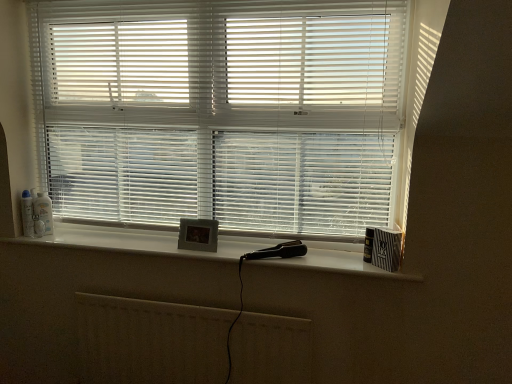
This screenshot has width=512, height=384. What do you see at coordinates (44, 211) in the screenshot? I see `white plastic bottle at left, the 1th toiletry viewed from the right` at bounding box center [44, 211].

Find the location of `white plastic bottle at left, the 1th toiletry viewed from the right`. white plastic bottle at left, the 1th toiletry viewed from the right is located at coordinates coord(44,211).

This screenshot has width=512, height=384. I want to click on white glossy spray can at left, which is the second toiletry in right-to-left order, so click(27, 214).

Is white glossy spray can at left, which is the second toiletry in right-to-left order, looking in the opposite direction of white matte window sill at center?

white glossy spray can at left, which is the second toiletry in right-to-left order, does not have its back to white matte window sill at center.

Consider the image. Can you confirm if white glossy spray can at left, which is the second toiletry in right-to-left order, is positioned to the right of white matte window sill at center?

No, white glossy spray can at left, which is the second toiletry in right-to-left order, is not to the right of white matte window sill at center.

Is there a large distance between white glossy spray can at left, which is the second toiletry in right-to-left order, and white matte window sill at center?

Actually, white glossy spray can at left, which is the second toiletry in right-to-left order, and white matte window sill at center are a little close together.

From the white matte window sill at center, count 1st toiletrys backward and point to it. Please provide its 2D coordinates.

[(27, 214)]

Between white matte radiator at lower center and white plastic blinds at center, which one has less height?

white matte radiator at lower center.

From the image's perspective, is white matte radiator at lower center over white plastic blinds at center?

No, from the image's perspective, white matte radiator at lower center is not on top of white plastic blinds at center.

The width and height of the screenshot is (512, 384). I want to click on window blind that appears above the white matte radiator at lower center (from the image's perspective), so click(222, 111).

Are white matte radiator at lower center and white plastic blinds at center beside each other?

No.

Which object is closer to the camera taking this photo, white matte radiator at lower center or white plastic bottle at left, which is the 2th toiletry from left to right?

white matte radiator at lower center is in front.

Is white matte radiator at lower center thinner than white plastic bottle at left, the 1th toiletry viewed from the right?

No.

Considering the positions of point (266, 355) and point (38, 209), is point (266, 355) closer or farther from the camera than point (38, 209)?

Point (266, 355) appears to be closer to the viewer than point (38, 209).

From the image's perspective, which is below, white matte radiator at lower center or white plastic bottle at left, which is the 2th toiletry from left to right?

white matte radiator at lower center is shown below in the image.

Considering the sizes of objects white matte window sill at center and white plastic bottle at left, which is the 2th toiletry from left to right, in the image provided, who is bigger, white matte window sill at center or white plastic bottle at left, which is the 2th toiletry from left to right,?

Bigger between the two is white matte window sill at center.

Does white matte window sill at center turn towards white plastic bottle at left, the 1th toiletry viewed from the right?

No, white matte window sill at center is not facing towards white plastic bottle at left, the 1th toiletry viewed from the right.

Is white matte window sill at center directly adjacent to white plastic bottle at left, the 1th toiletry viewed from the right?

No, white matte window sill at center is not making contact with white plastic bottle at left, the 1th toiletry viewed from the right.

Do you think white plastic bottle at left, which is the 2th toiletry from left to right, is within white glossy spray can at left, acting as the 1th toiletry starting from the left, or outside of it?

white plastic bottle at left, which is the 2th toiletry from left to right, cannot be found inside white glossy spray can at left, acting as the 1th toiletry starting from the left.

From the image's perspective, is white plastic bottle at left, which is the 2th toiletry from left to right, above or below white glossy spray can at left, which is the second toiletry in right-to-left order?

From the image's perspective, white plastic bottle at left, which is the 2th toiletry from left to right, appears above white glossy spray can at left, which is the second toiletry in right-to-left order.

Is point (46, 232) closer or farther from the camera than point (31, 203)?

Point (46, 232) is positioned farther from the camera compared to point (31, 203).

From a real-world perspective, is white plastic bottle at left, which is the 2th toiletry from left to right, physically below white glossy spray can at left, which is the second toiletry in right-to-left order?

Yes, from a real-world perspective, white plastic bottle at left, which is the 2th toiletry from left to right, is beneath white glossy spray can at left, which is the second toiletry in right-to-left order.

Is white matte radiator at lower center bigger or smaller than white matte window sill at center?

white matte radiator at lower center is bigger than white matte window sill at center.

From the image's perspective, is white matte radiator at lower center located above or below white matte window sill at center?

From the image's perspective, white matte radiator at lower center appears below white matte window sill at center.

Considering their positions, is white matte radiator at lower center located in front of or behind white matte window sill at center?

Visually, white matte radiator at lower center is located behind white matte window sill at center.

The width and height of the screenshot is (512, 384). In order to click on window sill located above the white matte radiator at lower center (from a real-world perspective) in this screenshot , I will do `click(142, 241)`.

How many degrees apart are the facing directions of white plastic bottle at left, the 1th toiletry viewed from the right, and white matte radiator at lower center?

They differ by 48.4 degrees in their facing directions.

Based on the photo, which is correct: white plastic bottle at left, the 1th toiletry viewed from the right, is inside white matte radiator at lower center, or outside of it?

The correct answer is: outside.

Considering the relative positions of white plastic bottle at left, the 1th toiletry viewed from the right, and white matte radiator at lower center in the image provided, is white plastic bottle at left, the 1th toiletry viewed from the right, behind white matte radiator at lower center?

Yes, the depth of white plastic bottle at left, the 1th toiletry viewed from the right, is greater than that of white matte radiator at lower center.

From the image's perspective, would you say white plastic bottle at left, which is the 2th toiletry from left to right, is positioned over white matte radiator at lower center?

Yes, from the image's perspective, white plastic bottle at left, which is the 2th toiletry from left to right, is over white matte radiator at lower center.

You are a GUI agent. You are given a task and a screenshot of the screen. Output one action in this format:
    pyautogui.click(x=<x>, y=<y>)
    Task: Click on the window sill on the right of white glossy spray can at left, acting as the 1th toiletry starting from the left
    The width and height of the screenshot is (512, 384).
    Given the screenshot: What is the action you would take?
    pyautogui.click(x=142, y=241)

Where is `window blind above the white matte radiator at lower center (from the image's perspective)`? window blind above the white matte radiator at lower center (from the image's perspective) is located at coordinates pos(222,111).

Looking at the image, which one is located closer to white matte window sill at center, white glossy spray can at left, which is the second toiletry in right-to-left order, or white plastic blinds at center?

white plastic blinds at center.

From the picture: Estimate the real-world distances between objects in this image. Which object is closer to white plastic bottle at left, which is the 2th toiletry from left to right, white matte window sill at center or white glossy spray can at left, acting as the 1th toiletry starting from the left?

white glossy spray can at left, acting as the 1th toiletry starting from the left, lies closer to white plastic bottle at left, which is the 2th toiletry from left to right, than the other object.

Considering their positions, is white plastic blinds at center positioned further to white matte window sill at center than white matte radiator at lower center?

white plastic blinds at center is positioned further to the anchor white matte window sill at center.

Based on their spatial positions, is white matte window sill at center or white plastic blinds at center closer to white glossy spray can at left, acting as the 1th toiletry starting from the left?

white matte window sill at center.

Which object lies further to the anchor point white glossy spray can at left, acting as the 1th toiletry starting from the left, white matte radiator at lower center or white plastic blinds at center?

The object further to white glossy spray can at left, acting as the 1th toiletry starting from the left, is white plastic blinds at center.

When comparing their distances from white matte window sill at center, does white matte radiator at lower center or white glossy spray can at left, acting as the 1th toiletry starting from the left, seem further?

white glossy spray can at left, acting as the 1th toiletry starting from the left, is further to white matte window sill at center.

From the image, which object appears to be nearer to white plastic bottle at left, which is the 2th toiletry from left to right, white matte radiator at lower center or white matte window sill at center?

Based on the image, white matte window sill at center appears to be nearer to white plastic bottle at left, which is the 2th toiletry from left to right.

Looking at the image, which one is located closer to white matte window sill at center, white glossy spray can at left, acting as the 1th toiletry starting from the left, or white matte radiator at lower center?

white matte radiator at lower center lies closer to white matte window sill at center than the other object.

I want to click on window sill between white plastic blinds at center and white matte radiator at lower center from top to bottom, so click(142, 241).

Where is `window sill situated between white glossy spray can at left, acting as the 1th toiletry starting from the left, and white plastic blinds at center from left to right`? window sill situated between white glossy spray can at left, acting as the 1th toiletry starting from the left, and white plastic blinds at center from left to right is located at coordinates coord(142,241).

Locate an element on the screen. Image resolution: width=512 pixels, height=384 pixels. radiator between white glossy spray can at left, acting as the 1th toiletry starting from the left, and white matte window sill at center is located at coordinates (151, 341).

This screenshot has width=512, height=384. In order to click on toiletry between white glossy spray can at left, acting as the 1th toiletry starting from the left, and white matte window sill at center in this screenshot , I will do `click(44, 211)`.